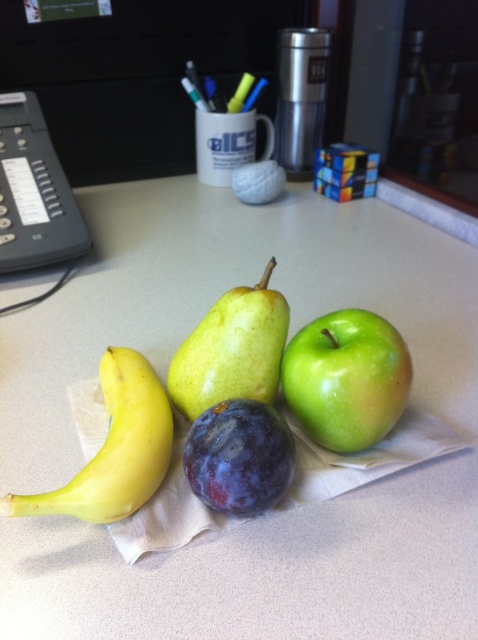
Is white paper towel at center taller than green matte pear at center?

Correct, white paper towel at center is much taller as green matte pear at center.

This screenshot has width=478, height=640. What do you see at coordinates (164, 380) in the screenshot? I see `white paper towel at center` at bounding box center [164, 380].

Locate an element on the screen. The image size is (478, 640). white paper towel at center is located at coordinates (164, 380).

Between point (152, 470) and point (43, 186), which one is positioned behind?

The point (43, 186) is behind.

Which is behind, point (133, 483) or point (21, 186)?

The point (21, 186) is behind.

Find the location of `yellow smooth banana at left`. yellow smooth banana at left is located at coordinates (115, 449).

Who is more forward, (105, 504) or (231, 499)?

Point (231, 499) is more forward.

How distant is yellow smooth banana at left from purple matte plum at center?

A distance of 3.40 inches exists between yellow smooth banana at left and purple matte plum at center.

Is point (130, 404) behind point (289, 433)?

Yes, point (130, 404) is behind point (289, 433).

In order to click on yellow smooth banana at left in this screenshot , I will do `click(115, 449)`.